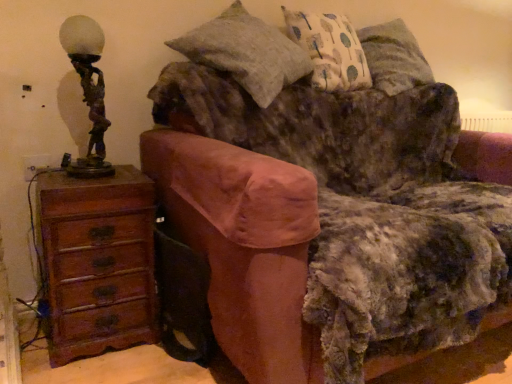
Question: From the image's perspective, relative to velvet brown couch at center, is bronze statue at left above or below?

Choices:
 (A) above
 (B) below

Answer: (A)

Question: Is bronze statue at left situated inside velvet brown couch at center or outside?

Choices:
 (A) inside
 (B) outside

Answer: (B)

Question: Estimate the real-world distances between objects in this image. Which object is closer to the brown wood chest of drawers at left?

Choices:
 (A) patterned fabric pillow at upper right, acting as the 2th pillow starting from the left
 (B) velvet brown couch at center
 (C) bronze statue at left
 (D) textured gray pillow at upper center, the 2th pillow when ordered from right to left

Answer: (C)

Question: Estimate the real-world distances between objects in this image. Which object is closer to the brown wood chest of drawers at left?

Choices:
 (A) patterned fabric pillow at upper right, acting as the 2th pillow starting from the left
 (B) bronze statue at left
 (C) textured gray pillow at upper center, the 2th pillow when ordered from right to left
 (D) velvet brown couch at center

Answer: (B)